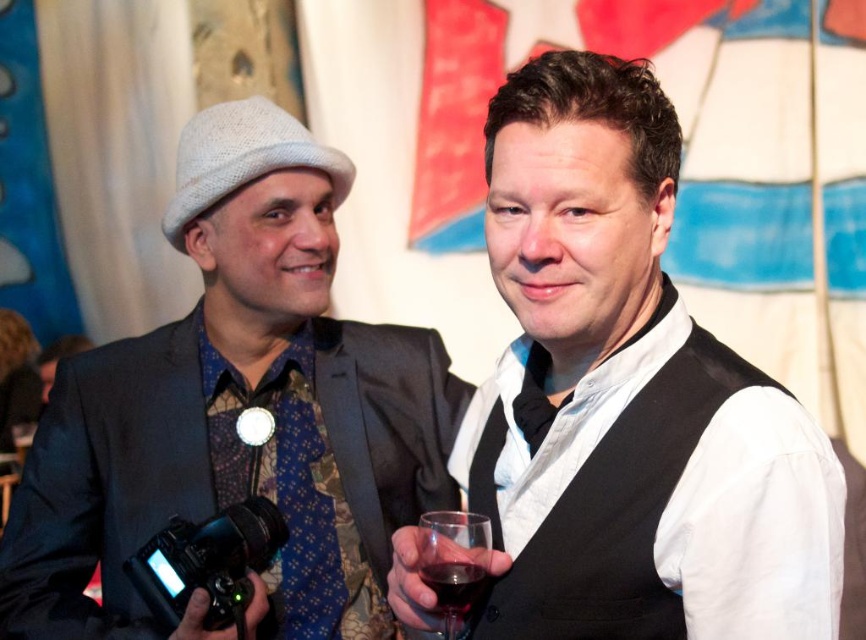
Measure the distance between point (606, 636) and camera.

Point (606, 636) is 1.21 meters away from camera.

Can you confirm if black satin vest at right is bigger than ruby glass at center?

Indeed, black satin vest at right has a larger size compared to ruby glass at center.

Describe the element at coordinates (617, 515) in the screenshot. I see `black satin vest at right` at that location.

Image resolution: width=866 pixels, height=640 pixels. I want to click on black satin vest at right, so click(x=617, y=515).

Who is shorter, black plastic video camera at lower left or transparent glass at right?

transparent glass at right is shorter.

Between point (126, 576) and point (428, 579), which one is positioned behind?

The point (126, 576) is behind.

The width and height of the screenshot is (866, 640). Find the location of `black plastic video camera at lower left`. black plastic video camera at lower left is located at coordinates (208, 563).

Is matte black suit at left to the right of ruby glass at center from the viewer's perspective?

In fact, matte black suit at left is to the left of ruby glass at center.

Which is in front, point (350, 614) or point (443, 556)?

Point (443, 556) is more forward.

Locate an element on the screen. matte black suit at left is located at coordinates (238, 410).